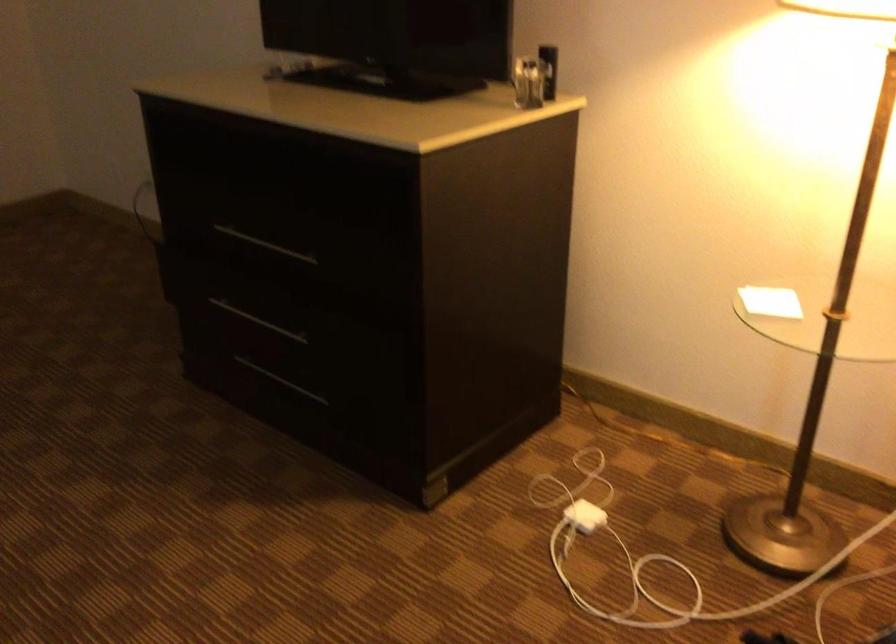
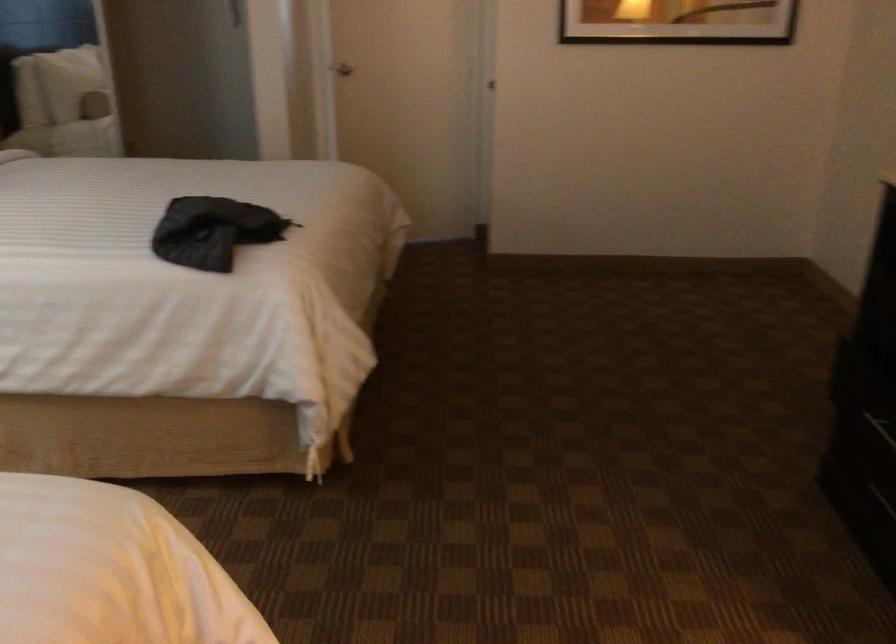
Question: The camera is either moving clockwise (left) or counter-clockwise (right) around the object. The first image is from the beginning of the video and the second image is from the end. Is the camera moving left or right when shooting the video?

Choices:
 (A) Left
 (B) Right

Answer: (B)